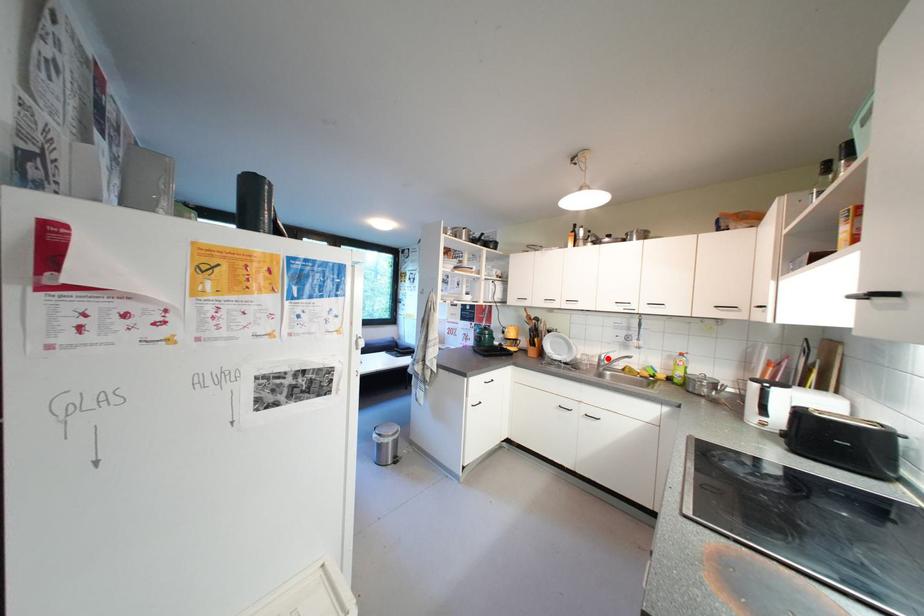
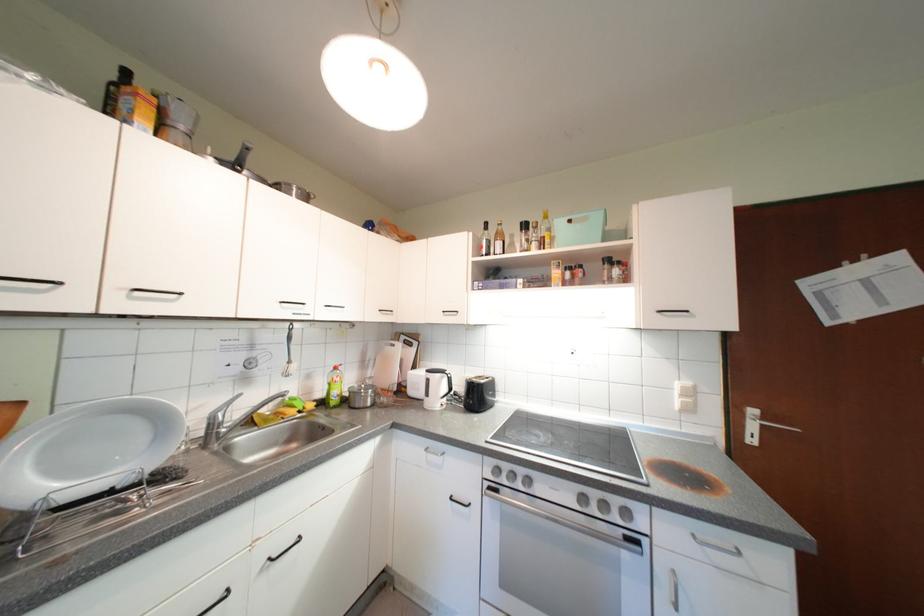
The point at the highlighted location is marked in the first image. Where is the corresponding point in the second image?

(220, 419)